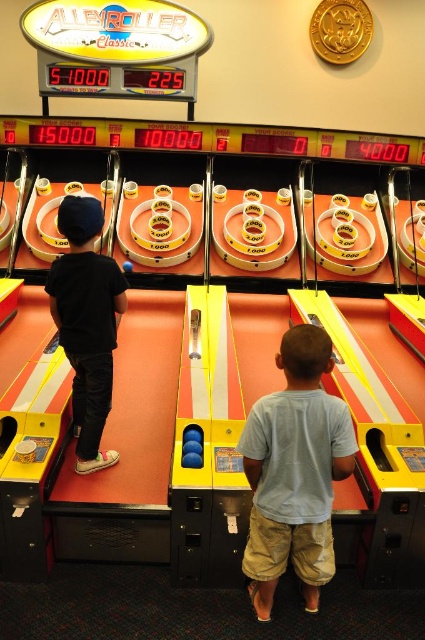
Question: Can you confirm if light blue cotton shirt at center is thinner than black matte shirt at left?

Choices:
 (A) no
 (B) yes

Answer: (A)

Question: Is light blue cotton shirt at center to the left of black matte shirt at left from the viewer's perspective?

Choices:
 (A) no
 (B) yes

Answer: (A)

Question: Is light blue cotton shirt at center in front of black matte shirt at left?

Choices:
 (A) no
 (B) yes

Answer: (B)

Question: Among these objects, which one is nearest to the camera?

Choices:
 (A) light blue cotton shirt at center
 (B) black matte shirt at left

Answer: (A)

Question: Which object appears closest to the camera in this image?

Choices:
 (A) light blue cotton shirt at center
 (B) black matte shirt at left

Answer: (A)

Question: Which point is farther from the camera taking this photo?

Choices:
 (A) (328, 408)
 (B) (93, 424)

Answer: (B)